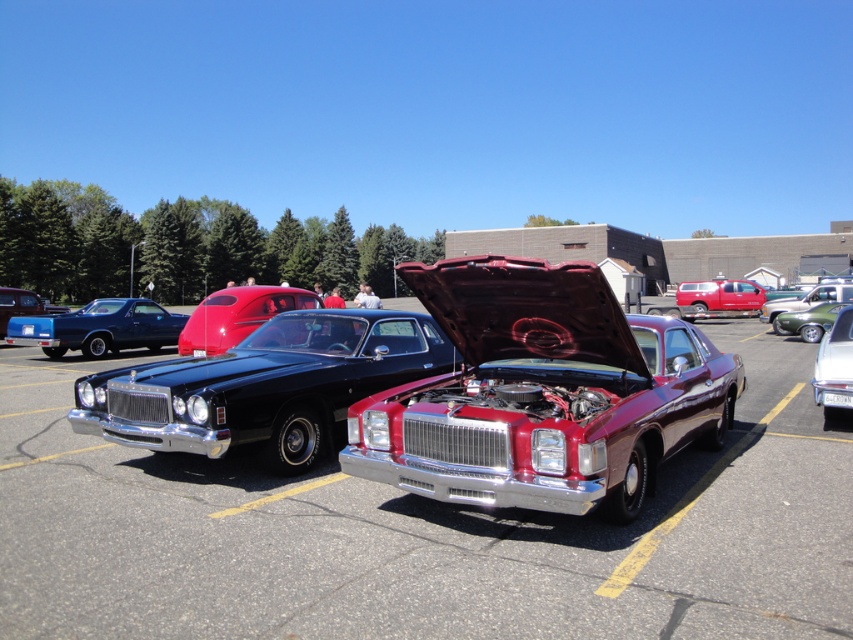
Which is more to the right, shiny blue car at left or green metallic car at right?

Positioned to the right is green metallic car at right.

Does shiny blue car at left appear over green metallic car at right?

Indeed, shiny blue car at left is positioned over green metallic car at right.

Locate an element on the screen. The width and height of the screenshot is (853, 640). shiny blue car at left is located at coordinates (97, 326).

Where is `shiny blue car at left`? shiny blue car at left is located at coordinates [x=97, y=326].

Is glossy black car at center in front of green metallic car at right?

Yes, it is in front of green metallic car at right.

Is point (322, 308) farther from viewer compared to point (817, 339)?

That is False.

Between point (177, 374) and point (799, 323), which one is positioned in front?

Point (177, 374)

Where is `glossy black car at center`? This screenshot has width=853, height=640. glossy black car at center is located at coordinates (264, 385).

Is glossy red car at center positioned at the back of metallic green car at center?

No.

Is point (264, 307) positioned in front of point (770, 307)?

That is True.

This screenshot has height=640, width=853. I want to click on glossy red car at center, so click(236, 316).